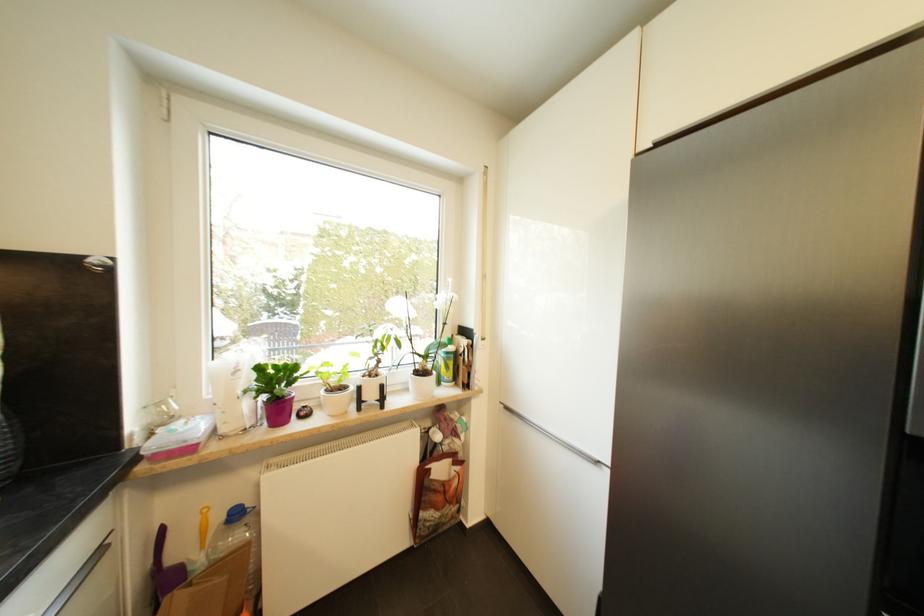
Find the location of a particular element. This screenshot has height=616, width=924. pink container lid is located at coordinates (178, 438).